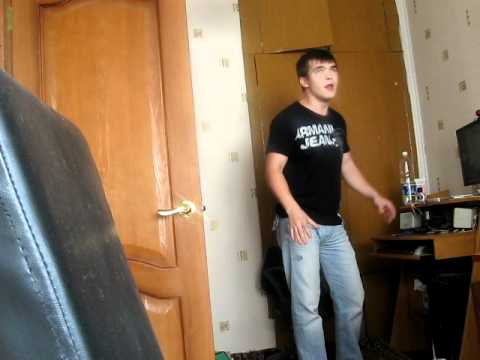
Locate an element on the screen. The height and width of the screenshot is (360, 480). screen is located at coordinates (454, 148).